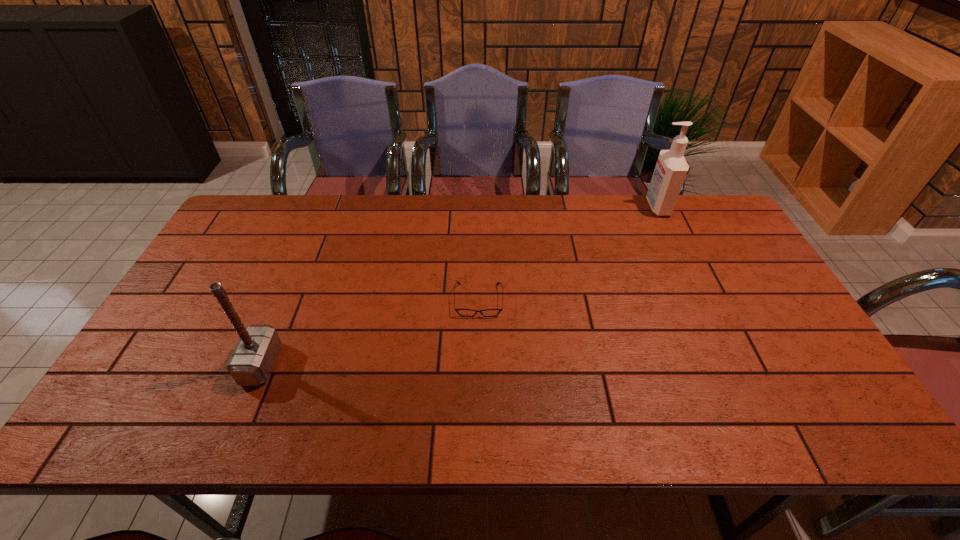
This screenshot has height=540, width=960. I want to click on vacant space located 0.050m on the front-facing side of the second object from left to right, so 478,333.

Identify the location of object at the far edge. The height and width of the screenshot is (540, 960). (671, 168).

Where is `free spot at the far edge of the desktop`? free spot at the far edge of the desktop is located at coordinates (336, 226).

Image resolution: width=960 pixels, height=540 pixels. In the image, there is a desktop. What are the coordinates of `free space at the near edge` in the screenshot? It's located at (636, 435).

Where is `vacant region at the left edge of the desktop`? The height and width of the screenshot is (540, 960). vacant region at the left edge of the desktop is located at coordinates (166, 326).

The image size is (960, 540). I want to click on vacant space at the right edge of the desktop, so click(727, 287).

Image resolution: width=960 pixels, height=540 pixels. What are the coordinates of `blank space at the far right corner of the desktop` in the screenshot? It's located at (690, 237).

This screenshot has width=960, height=540. Find the location of `vacant area at the near right corner`. vacant area at the near right corner is located at coordinates (819, 411).

The image size is (960, 540). I want to click on empty space that is in between the farthest object and the leftmost object, so click(x=459, y=286).

The width and height of the screenshot is (960, 540). What are the coordinates of `unoccupied position between the second farthest object and the leftmost object` in the screenshot? It's located at (370, 332).